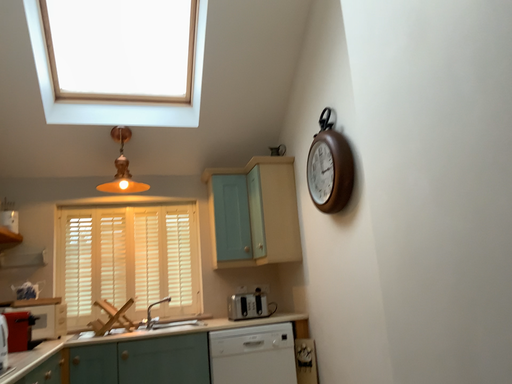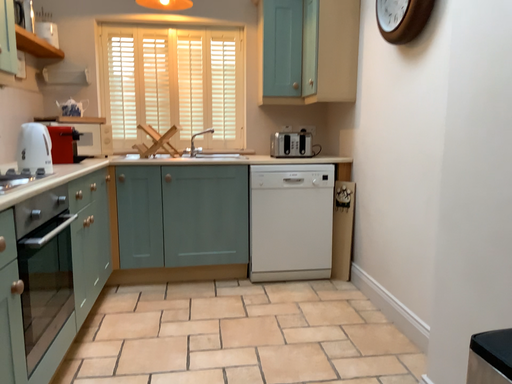
Question: Which way did the camera rotate in the video?

Choices:
 (A) rotated right
 (B) rotated left

Answer: (B)